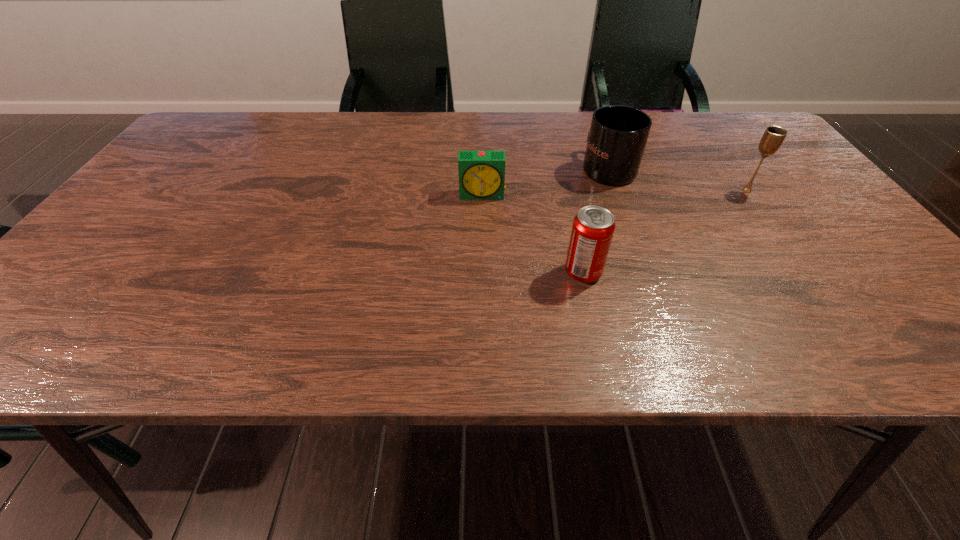
Locate an element on the screen. Image resolution: width=960 pixels, height=540 pixels. the rightmost object is located at coordinates (773, 137).

This screenshot has width=960, height=540. Find the location of `mug`. mug is located at coordinates (618, 135).

At what (x,y) coordinates should I click in order to perform the action: click on the third object from right to left. Please return your answer as a coordinate pair (x, y). This screenshot has width=960, height=540. Looking at the image, I should click on (593, 227).

The width and height of the screenshot is (960, 540). In order to click on soda can in this screenshot , I will do `click(593, 227)`.

Find the location of a particular element. The image size is (960, 540). the shortest object is located at coordinates (481, 173).

Where is `the leftmost object`? The image size is (960, 540). the leftmost object is located at coordinates (481, 173).

Locate an element on the screen. The height and width of the screenshot is (540, 960). vacant space located 0.220m on the front of the chalice is located at coordinates (796, 259).

Where is `vacant space situated 0.120m with the handle on the side of the mug`? This screenshot has height=540, width=960. vacant space situated 0.120m with the handle on the side of the mug is located at coordinates (593, 129).

This screenshot has width=960, height=540. Find the location of `free space located 0.200m with the handle on the side of the mug`. free space located 0.200m with the handle on the side of the mug is located at coordinates (588, 116).

The image size is (960, 540). I want to click on vacant space situated 0.180m with the handle on the side of the mug, so click(x=589, y=119).